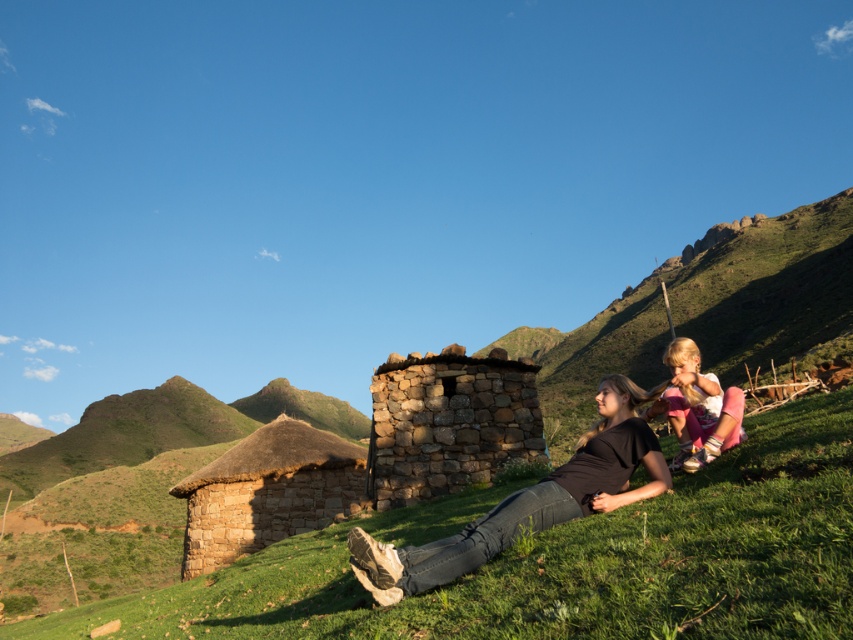
You are standing at the point marked by the coordinates point (564,561) in the image. What is the type of terrain you are currently standing on?

The point marked by the coordinates point (564,561) is on green grassy at lower center.

You are standing at the bottom of the image and want to place a small picnic basket on the green grassy at lower center. According to the coordinates provided, where exactly should you place it?

The green grassy at lower center is located at coordinates point (564, 561), so you should place the picnic basket there.

You are a photographer positioned at the lower right corner of the image. You want to take a photo of the thatched straw hut at center without the light pink fabric at lower right appearing in the frame. Is this possible?

The thatched straw hut at center is further to the viewer than the light pink fabric at lower right. Since the photographer is at the lower right corner, moving the camera angle upwards to focus on the thatched straw hut at center might allow capturing it without the light pink fabric at lower right obstructing the view. However, the exact feasibility depends on the distance and angle adjustments possible.